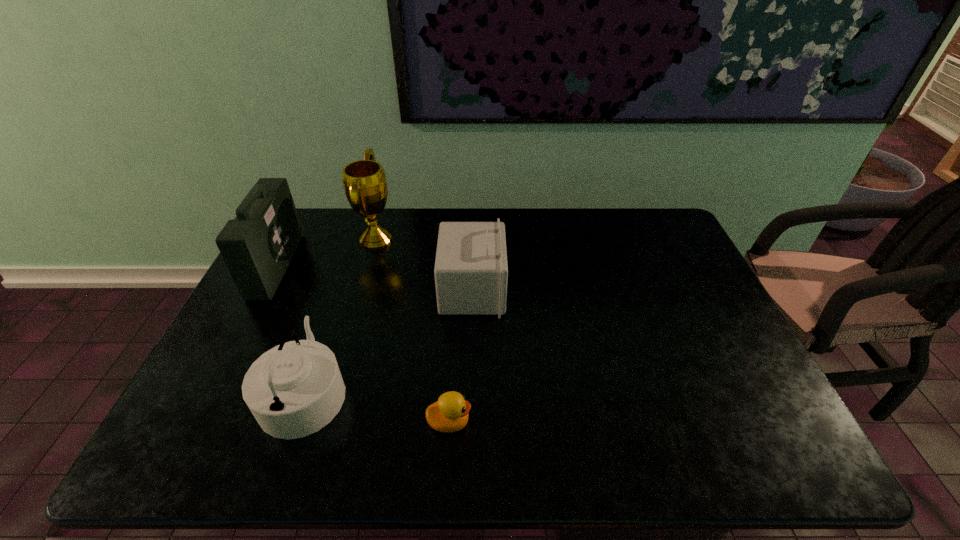
At what (x,y) coordinates should I click in order to perform the action: click on vacant space at the near edge of the desktop. Please return your answer as a coordinate pair (x, y). Looking at the image, I should click on (588, 458).

The height and width of the screenshot is (540, 960). In the image, there is a desktop. In order to click on vacant space at the right edge in this screenshot , I will do `click(701, 274)`.

You are a GUI agent. You are given a task and a screenshot of the screen. Output one action in this format:
    pyautogui.click(x=<x>, y=<y>)
    Task: Click on the vacant region at the far left corner of the desktop
    
    Given the screenshot: What is the action you would take?
    pyautogui.click(x=311, y=227)

Where is `vacant region at the far right corner of the desktop`? The height and width of the screenshot is (540, 960). vacant region at the far right corner of the desktop is located at coordinates coord(640,244).

Find the location of a particular element. This screenshot has width=960, height=540. vacant area between the duckling and the left first-aid kit is located at coordinates (363, 344).

At what (x,y) coordinates should I click in order to perform the action: click on vacant area that lies between the right first-aid kit and the award. Please return your answer as a coordinate pair (x, y). This screenshot has width=960, height=540. Looking at the image, I should click on (424, 265).

In order to click on vacant space that's between the right first-aid kit and the taller first-aid kit in this screenshot , I will do `click(374, 278)`.

Identify the location of vacant space that is in between the right first-aid kit and the kettle. The image size is (960, 540). (389, 341).

The height and width of the screenshot is (540, 960). Find the location of `vacant area that lies between the award and the taller first-aid kit`. vacant area that lies between the award and the taller first-aid kit is located at coordinates (326, 253).

Locate an element on the screen. This screenshot has width=960, height=540. vacant space that's between the right first-aid kit and the award is located at coordinates (424, 265).